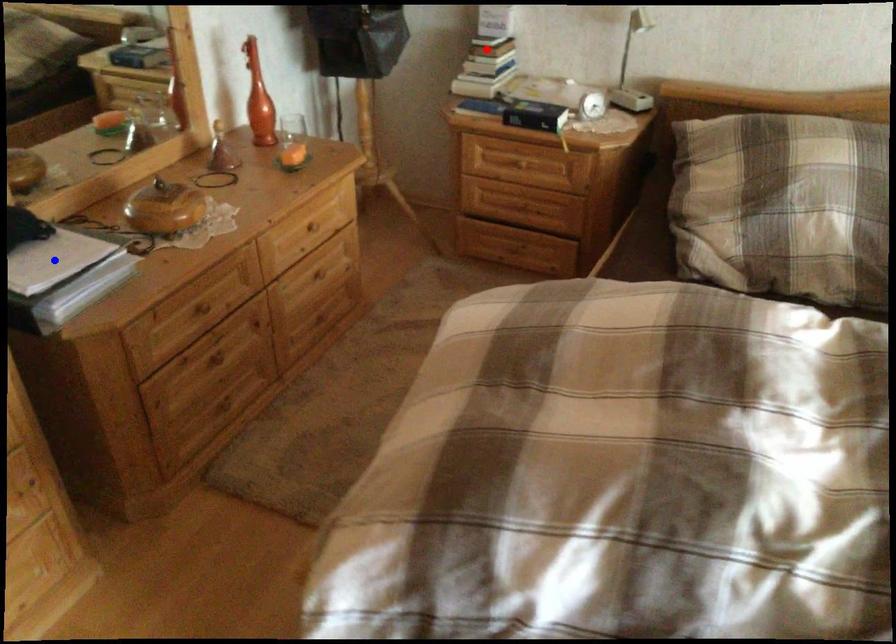
Question: Two points are marked on the image. Which point is closer to the camera?

Choices:
 (A) Blue point is closer.
 (B) Red point is closer.

Answer: (A)